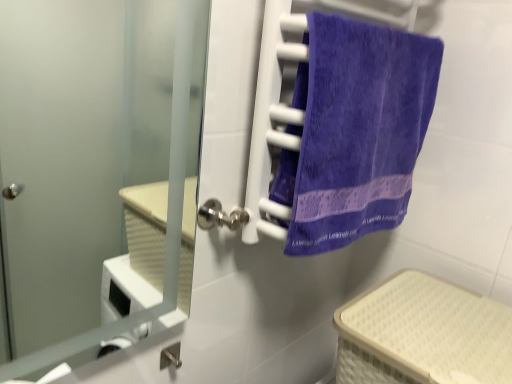
Question: Is purple terry cloth towel at right beside beige woven basket at lower right?

Choices:
 (A) no
 (B) yes

Answer: (A)

Question: From the image's perspective, is purple terry cloth towel at right over beige woven basket at lower right?

Choices:
 (A) yes
 (B) no

Answer: (A)

Question: From a real-world perspective, is purple terry cloth towel at right under beige woven basket at lower right?

Choices:
 (A) no
 (B) yes

Answer: (A)

Question: Is purple terry cloth towel at right positioned with its back to beige woven basket at lower right?

Choices:
 (A) no
 (B) yes

Answer: (A)

Question: Considering the relative sizes of purple terry cloth towel at right and beige woven basket at lower right in the image provided, is purple terry cloth towel at right smaller than beige woven basket at lower right?

Choices:
 (A) yes
 (B) no

Answer: (A)

Question: Does purple terry cloth towel at right have a lesser height compared to beige woven basket at lower right?

Choices:
 (A) no
 (B) yes

Answer: (A)

Question: From the image's perspective, would you say purple terry cloth towel at right is shown under satin silver door at center?

Choices:
 (A) no
 (B) yes

Answer: (A)

Question: Is satin silver door at center located within purple terry cloth towel at right?

Choices:
 (A) yes
 (B) no

Answer: (B)

Question: Is purple terry cloth towel at right smaller than satin silver door at center?

Choices:
 (A) no
 (B) yes

Answer: (A)

Question: Is purple terry cloth towel at right taller than satin silver door at center?

Choices:
 (A) yes
 (B) no

Answer: (B)

Question: From the image's perspective, is purple terry cloth towel at right on top of satin silver door at center?

Choices:
 (A) no
 (B) yes

Answer: (B)

Question: Is purple terry cloth towel at right facing towards satin silver door at center?

Choices:
 (A) yes
 (B) no

Answer: (B)

Question: Could you tell me if satin silver door at center is facing beige woven basket at lower right?

Choices:
 (A) yes
 (B) no

Answer: (B)